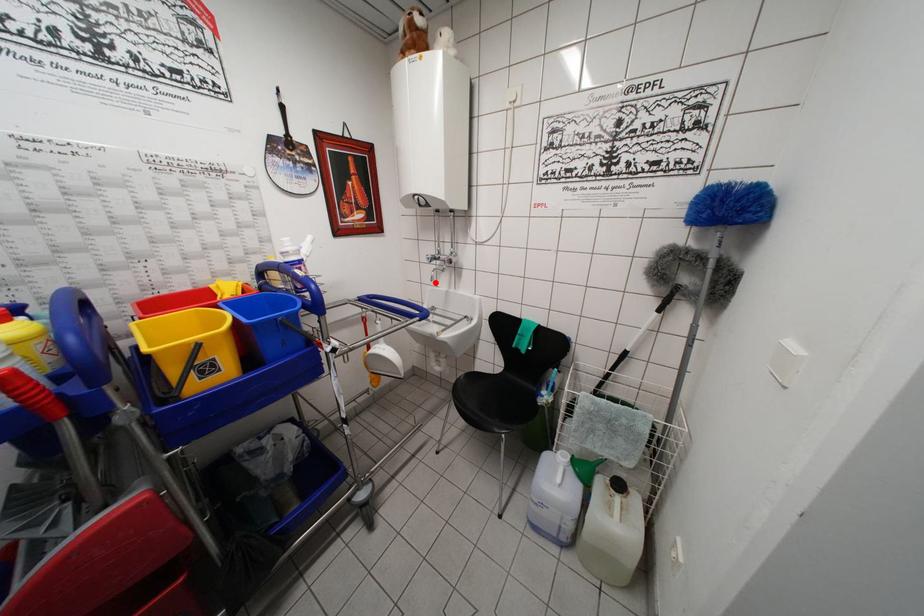
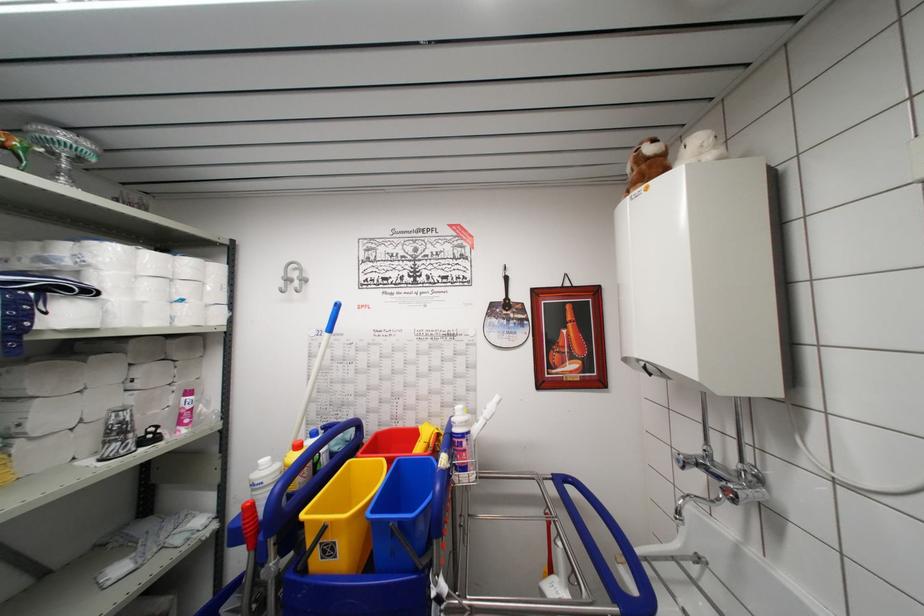
Question: I am providing you with two images of the same scene from different viewpoints. In image1, a red point is highlighted. Considering the same 3D point in image2, which of the following is correct?

Choices:
 (A) It is closer
 (B) It is farther

Answer: (B)